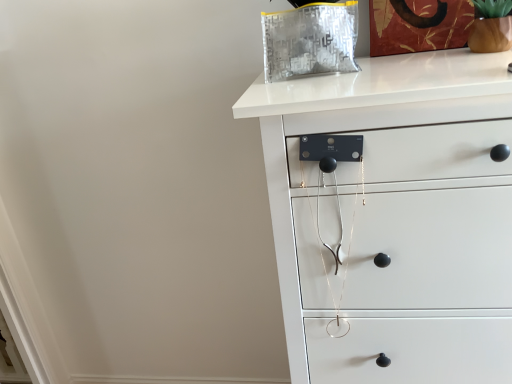
Question: Looking at their shapes, would you say brown matte glass vase at upper right is wider or thinner than white matte chest of drawers at upper right?

Choices:
 (A) thin
 (B) wide

Answer: (A)

Question: From their relative heights in the image, would you say brown matte glass vase at upper right is taller or shorter than white matte chest of drawers at upper right?

Choices:
 (A) short
 (B) tall

Answer: (A)

Question: Would you say brown matte glass vase at upper right is to the left or to the right of white matte chest of drawers at upper right in the picture?

Choices:
 (A) right
 (B) left

Answer: (A)

Question: From the image's perspective, is white matte chest of drawers at upper right positioned above or below brown matte glass vase at upper right?

Choices:
 (A) below
 (B) above

Answer: (A)

Question: Based on their sizes in the image, would you say white matte chest of drawers at upper right is bigger or smaller than brown matte glass vase at upper right?

Choices:
 (A) big
 (B) small

Answer: (A)

Question: Looking at their shapes, would you say white matte chest of drawers at upper right is wider or thinner than brown matte glass vase at upper right?

Choices:
 (A) thin
 (B) wide

Answer: (B)

Question: Visually, is white matte chest of drawers at upper right positioned to the left or to the right of brown matte glass vase at upper right?

Choices:
 (A) left
 (B) right

Answer: (A)